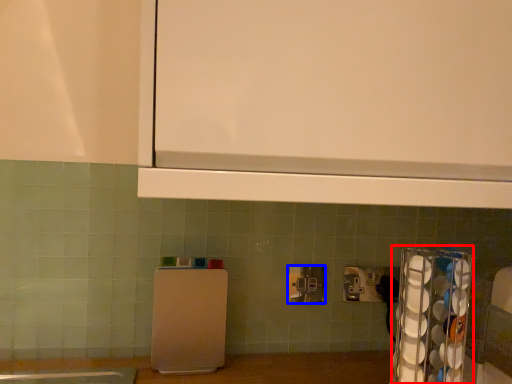
Question: Which object appears farthest to the camera in this image, appliance (highlighted by a red box) or power plugs and sockets (highlighted by a blue box)?

Choices:
 (A) appliance
 (B) power plugs and sockets

Answer: (B)